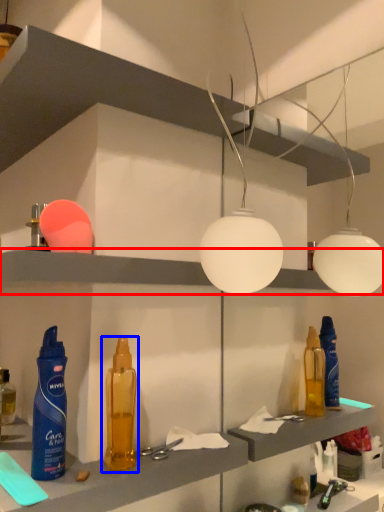
Question: Among these objects, which one is nearest to the camera, shelf (highlighted by a red box) or bottle (highlighted by a blue box)?

Choices:
 (A) shelf
 (B) bottle

Answer: (A)